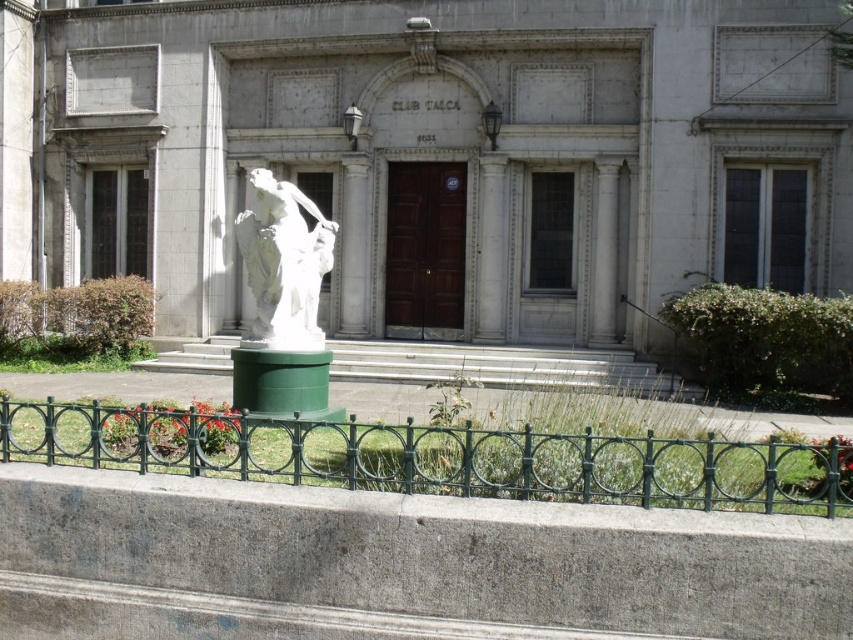
Question: Is green wrought iron fence at lower center bigger than white marble statue at center?

Choices:
 (A) yes
 (B) no

Answer: (A)

Question: Which object is closer to the camera taking this photo?

Choices:
 (A) green wrought iron fence at lower center
 (B) white marble statue at center

Answer: (A)

Question: Does green wrought iron fence at lower center lie behind white marble statue at center?

Choices:
 (A) no
 (B) yes

Answer: (A)

Question: Which object appears farthest from the camera in this image?

Choices:
 (A) white marble statue at center
 (B) green wrought iron fence at lower center

Answer: (A)

Question: Does green wrought iron fence at lower center appear on the right side of white marble statue at center?

Choices:
 (A) yes
 (B) no

Answer: (A)

Question: Which of the following is the closest to the observer?

Choices:
 (A) green wrought iron fence at lower center
 (B) white marble statue at center

Answer: (A)